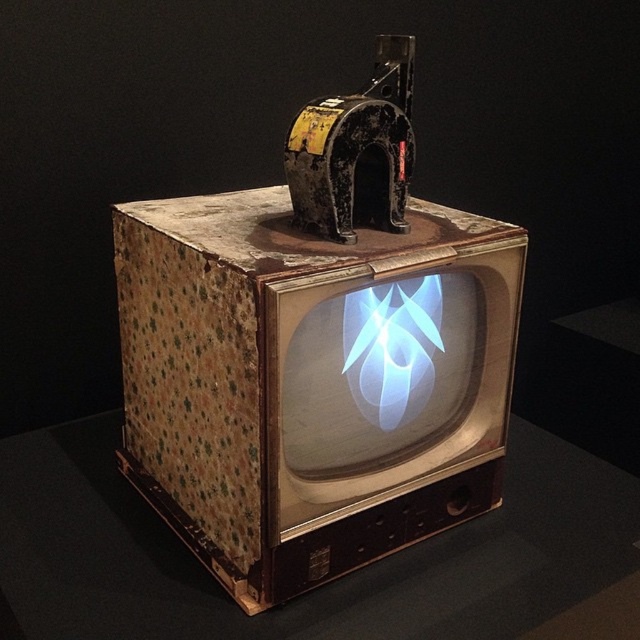
You are an interior designer assessing the placement of objects in this vintage TV setup. There is a point marked at coordinates (310,381). Which object from the scene does this point belong to?

The point at coordinates (310,381) is on the rusty cardboard box at center.

You are standing in front of the vintage television set and notice a rusty cardboard box at center and a wooden table at center. Which object is nearer to you?

The rusty cardboard box at center is closer to the viewer than the wooden table at center.